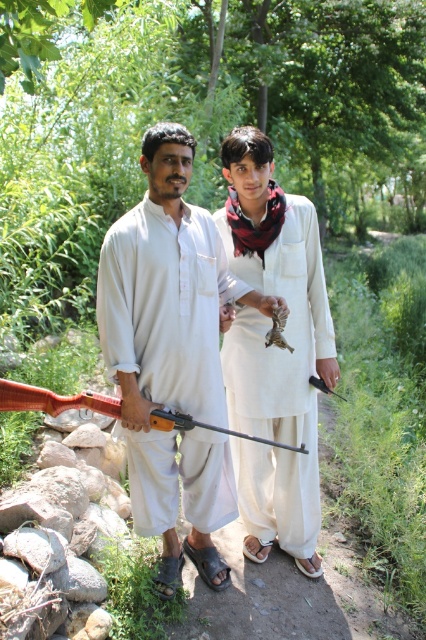
Between matte white shirt at center and wooden smooth shotgun at lower left, which one appears on the right side from the viewer's perspective?

From the viewer's perspective, matte white shirt at center appears more on the right side.

At what (x,y) coordinates should I click in order to perform the action: click on matte white shirt at center. Please return your answer as a coordinate pair (x, y). Looking at the image, I should click on (172, 353).

Does matte white robe at center have a lesser height compared to wooden smooth shotgun at lower left?

Incorrect, matte white robe at center's height does not fall short of wooden smooth shotgun at lower left's.

Is point (201, 397) positioned behind point (285, 449)?

Yes.

Image resolution: width=426 pixels, height=640 pixels. Find the location of `matte white robe at center`. matte white robe at center is located at coordinates click(166, 307).

Does point (155, 285) come closer to viewer compared to point (134, 504)?

Yes, point (155, 285) is in front of point (134, 504).

What are the coordinates of `matte white shirt at center` in the screenshot? It's located at (172, 353).

Locate an element on the screen. The height and width of the screenshot is (640, 426). matte white shirt at center is located at coordinates (172, 353).